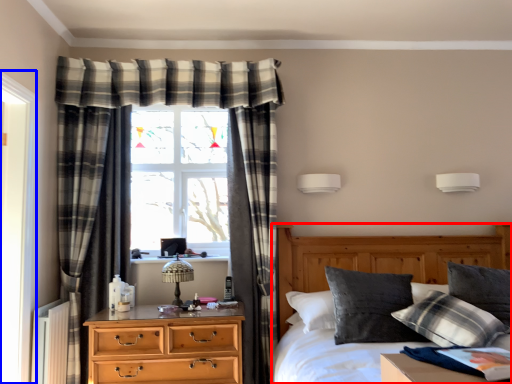
Question: Which object is further to the camera taking this photo, bed (highlighted by a red box) or screen door (highlighted by a blue box)?

Choices:
 (A) bed
 (B) screen door

Answer: (B)